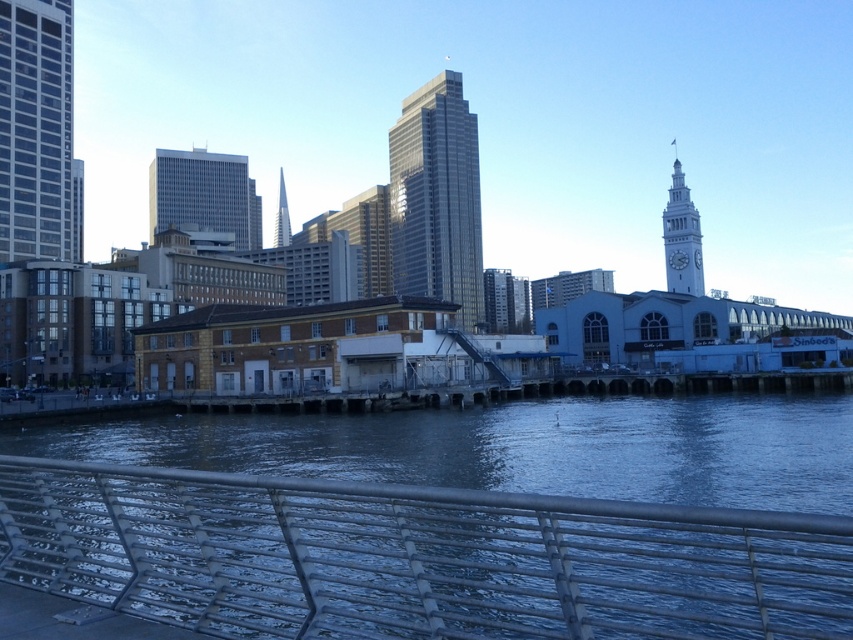
Does glassy metallic skyscraper at center have a greater height compared to white stone clock tower at upper right?

Yes, glassy metallic skyscraper at center is taller than white stone clock tower at upper right.

Which is more to the left, glassy metallic skyscraper at center or white stone clock tower at upper right?

From the viewer's perspective, glassy metallic skyscraper at center appears more on the left side.

Between point (416, 205) and point (683, 205), which one is positioned behind?

The point (416, 205) is more distant.

Locate an element on the screen. glassy metallic skyscraper at center is located at coordinates (436, 198).

Between point (480, 268) and point (280, 196), which one is positioned behind?

Point (280, 196)

Does point (422, 257) come behind point (286, 218)?

No, (422, 257) is closer to viewer.

Locate an element on the screen. This screenshot has width=853, height=640. glassy metallic skyscraper at center is located at coordinates (436, 198).

Image resolution: width=853 pixels, height=640 pixels. I want to click on glassy metallic skyscraper at center, so click(436, 198).

Who is positioned more to the right, metallic silver rail at lower center or glassy steel skyscraper at left?

Positioned to the right is metallic silver rail at lower center.

Is point (138, 508) positioned after point (48, 83)?

No, (138, 508) is in front of (48, 83).

What do you see at coordinates (415, 557) in the screenshot?
I see `metallic silver rail at lower center` at bounding box center [415, 557].

This screenshot has width=853, height=640. In order to click on metallic silver rail at lower center in this screenshot , I will do `click(415, 557)`.